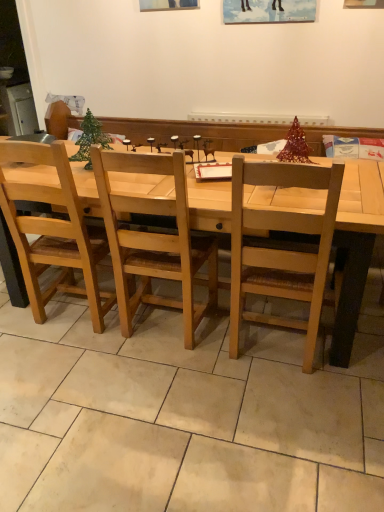
Image resolution: width=384 pixels, height=512 pixels. Identify the location of free space between light wood chair at center, the 2th chair viewed from the left, and natural wood table at center. (185, 352).